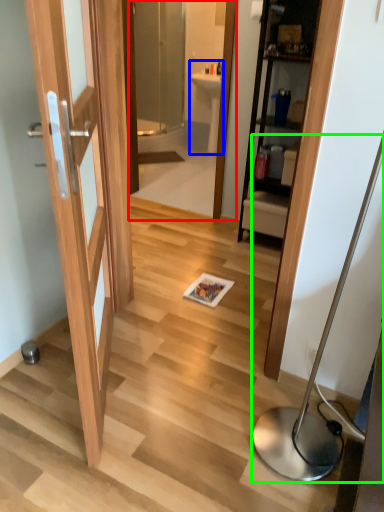
Question: Which is farther away from mirror (highlighted by a red box)? sink (highlighted by a blue box) or table lamp (highlighted by a green box)?

Choices:
 (A) sink
 (B) table lamp

Answer: (B)